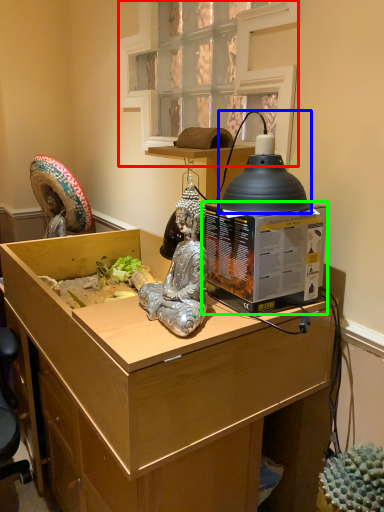
Question: Which is farther away from window (highlighted by a red box)? lamp (highlighted by a blue box) or box (highlighted by a green box)?

Choices:
 (A) lamp
 (B) box

Answer: (B)